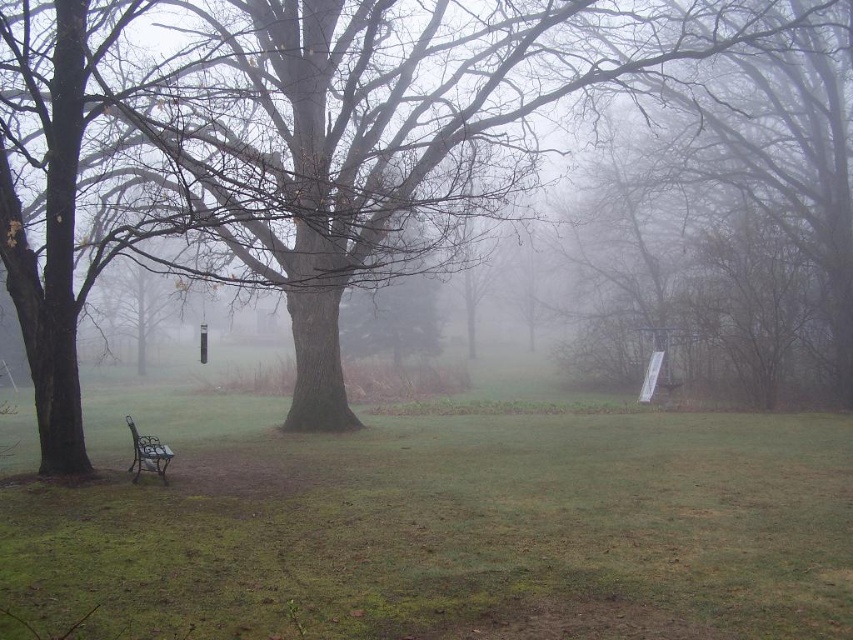
Can you confirm if brown matte tree at center is positioned below metallic brown bench at lower left?

Actually, brown matte tree at center is above metallic brown bench at lower left.

Between brown matte tree at center and metallic brown bench at lower left, which one has more height?

brown matte tree at center is taller.

Which is in front, point (318, 422) or point (140, 461)?

Point (140, 461) is in front.

Find the location of `brown matte tree at center`. brown matte tree at center is located at coordinates (285, 147).

Between green grass at lower center and metallic brown bench at lower left, which one is positioned higher?

metallic brown bench at lower left is higher up.

Find the location of `green grass at lower center`. green grass at lower center is located at coordinates (440, 525).

You are a GUI agent. You are given a task and a screenshot of the screen. Output one action in this format:
    pyautogui.click(x=<x>, y=<y>)
    Task: Click on the green grass at lower center
    This screenshot has height=640, width=853.
    Given the screenshot: What is the action you would take?
    pyautogui.click(x=440, y=525)

Is point (393, 452) positioned after point (48, 195)?

That is True.

Who is positioned more to the left, green grass at lower center or brown matte tree at center?

brown matte tree at center

Where is `green grass at lower center`? The image size is (853, 640). green grass at lower center is located at coordinates (440, 525).